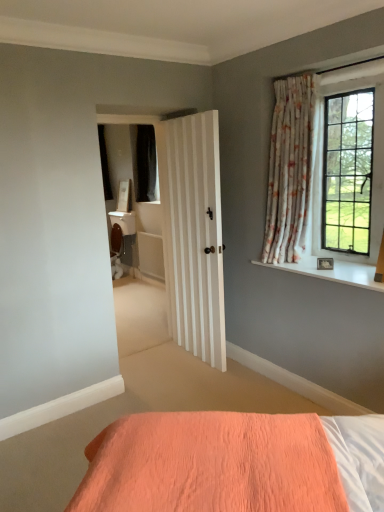
Question: Relative to white smooth window sill at upper right, is floral fabric curtain at upper right in front or behind?

Choices:
 (A) front
 (B) behind

Answer: (B)

Question: From the image's perspective, is floral fabric curtain at upper right above or below white smooth window sill at upper right?

Choices:
 (A) below
 (B) above

Answer: (B)

Question: Which object is the closest to the floral fabric curtain at upper right?

Choices:
 (A) clear glass window at upper right
 (B) white smooth window sill at upper right

Answer: (A)

Question: Estimate the real-world distances between objects in this image. Which object is closer to the clear glass window at upper right?

Choices:
 (A) white smooth window sill at upper right
 (B) floral fabric curtain at upper right

Answer: (B)